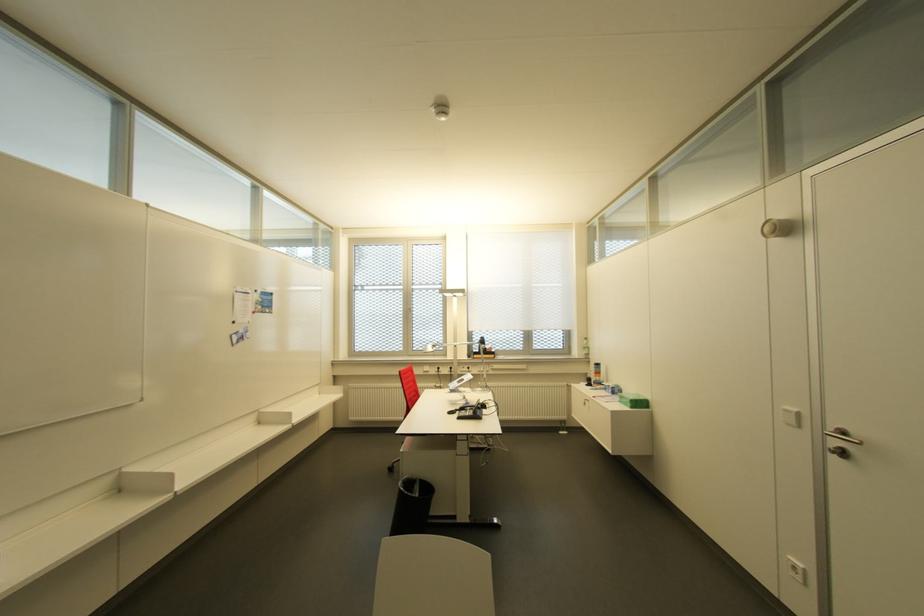
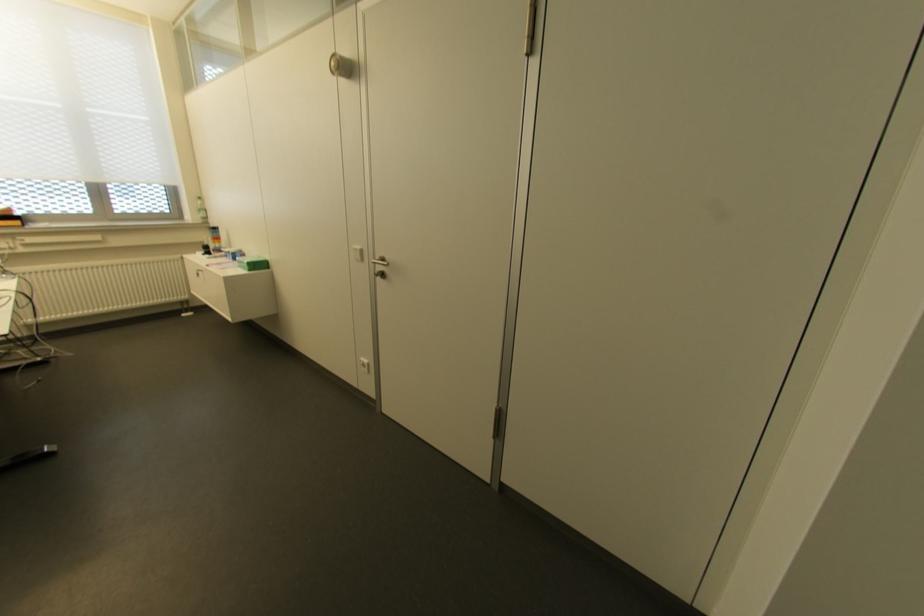
The point at (850,432) is marked in the first image. Where is the corresponding point in the second image?

(384, 257)